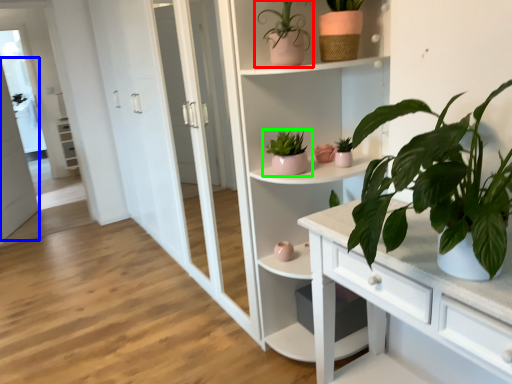
Question: Which object is positioned farthest from houseplant (highlighted by a red box)? Select from screen door (highlighted by a blue box) and houseplant (highlighted by a green box).

Choices:
 (A) screen door
 (B) houseplant

Answer: (A)